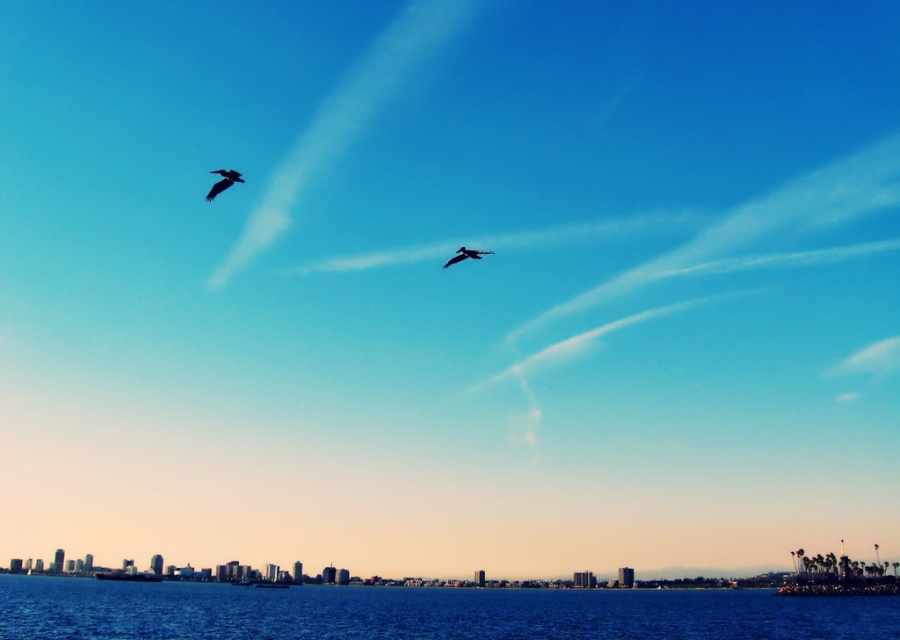
Looking at this image, can you confirm if blue water at lower center is shorter than silhouette feathered bird at upper left?

In fact, blue water at lower center may be taller than silhouette feathered bird at upper left.

Is blue water at lower center bigger than silhouette feathered bird at upper left?

Indeed, blue water at lower center has a larger size compared to silhouette feathered bird at upper left.

This screenshot has width=900, height=640. I want to click on blue water at lower center, so click(423, 611).

Which is more to the left, blue water at lower center or silvery metallic bird at center?

silvery metallic bird at center

Can you confirm if blue water at lower center is taller than silvery metallic bird at center?

Yes, blue water at lower center is taller than silvery metallic bird at center.

Is point (59, 612) closer to camera compared to point (490, 252)?

Yes, point (59, 612) is in front of point (490, 252).

I want to click on blue water at lower center, so click(x=423, y=611).

Who is shorter, silhouette feathered bird at upper left or silvery metallic bird at center?

With less height is silvery metallic bird at center.

Is point (207, 195) in front of point (451, 262)?

No, (207, 195) is further to viewer.

This screenshot has width=900, height=640. Find the location of `silhouette feathered bird at upper left`. silhouette feathered bird at upper left is located at coordinates (223, 180).